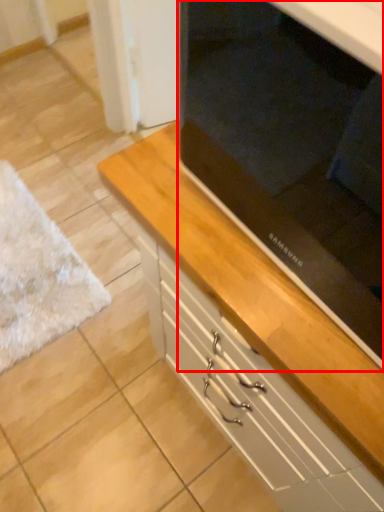
Question: In this image, where is appliance (annotated by the red box) located relative to chest of drawers?

Choices:
 (A) right
 (B) left

Answer: (A)